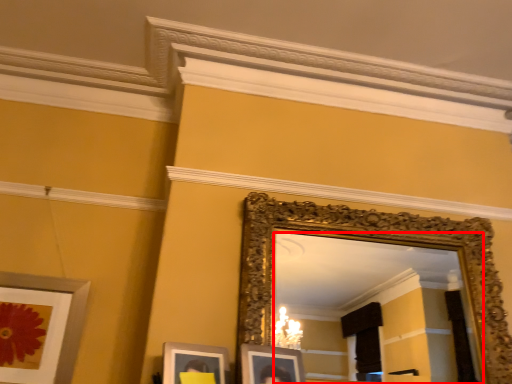
Question: From the image's perspective, where is mirror (annotated by the red box) located relative to picture frame?

Choices:
 (A) below
 (B) above

Answer: (B)